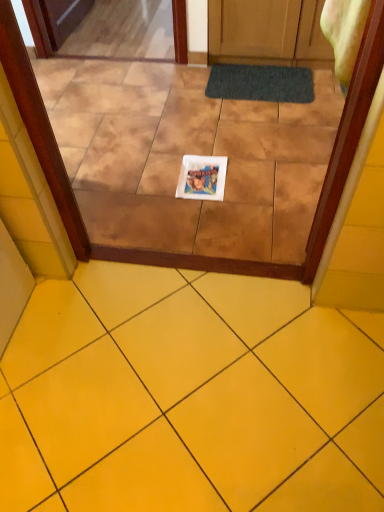
You are a GUI agent. You are given a task and a screenshot of the screen. Output one action in this format:
    pyautogui.click(x=<x>, y=<y>)
    Task: Click on the free point above dark gray textured bath mat at center (from a real-world perspective)
    
    Given the screenshot: What is the action you would take?
    pyautogui.click(x=259, y=78)